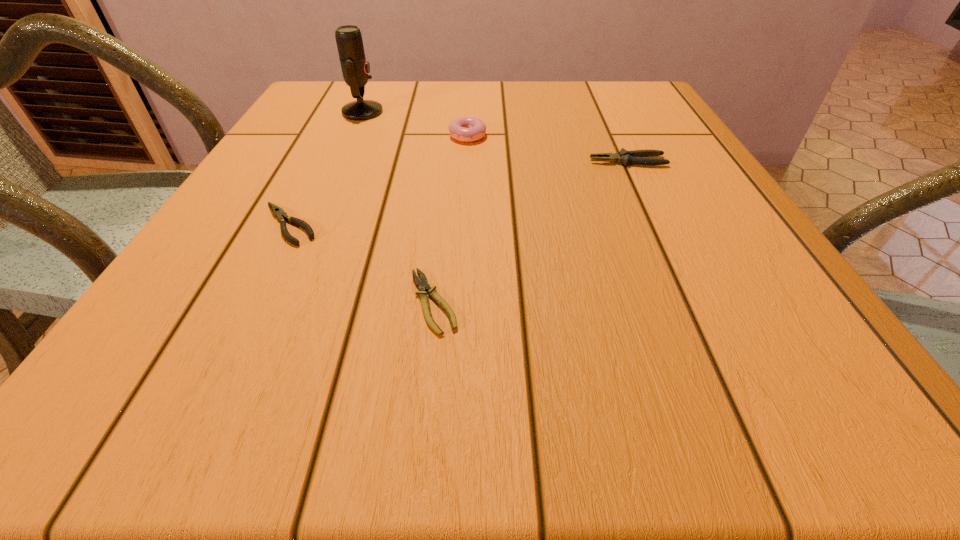
At what (x,y) coordinates should I click in order to perform the action: click on vacant space located on the side of the farthest object with the red ring. Please return your answer as a coordinate pair (x, y). The height and width of the screenshot is (540, 960). Looking at the image, I should click on 412,112.

The height and width of the screenshot is (540, 960). What are the coordinates of `vacant space located 0.310m on the right of the fourth nearest object` in the screenshot? It's located at (x=625, y=134).

Identify the location of vacant space located at the gripping part of the tallest pliers. (540, 161).

Where is `vacant space located 0.160m at the gripping part of the tallest pliers`? The height and width of the screenshot is (540, 960). vacant space located 0.160m at the gripping part of the tallest pliers is located at coordinates (512, 161).

You are a GUI agent. You are given a task and a screenshot of the screen. Output one action in this format:
    pyautogui.click(x=<x>, y=<y>)
    Task: Click on the free region located 0.070m at the gripping part of the tallest pliers
    The height and width of the screenshot is (540, 960).
    Given the screenshot: What is the action you would take?
    pyautogui.click(x=556, y=161)

Where is `free space located on the right of the leftmost pliers`? free space located on the right of the leftmost pliers is located at coordinates (363, 224).

Locate an element on the screen. vacant space located 0.180m on the back of the shortest pliers is located at coordinates (444, 203).

You are a GUI agent. You are given a task and a screenshot of the screen. Output one action in this format:
    pyautogui.click(x=<x>, y=<y>)
    Task: Click on the object located in the far edge section of the desktop
    
    Given the screenshot: What is the action you would take?
    pyautogui.click(x=355, y=68)

Locate an element on the screen. microphone located in the left edge section of the desktop is located at coordinates (355, 68).

Locate an element on the screen. The height and width of the screenshot is (540, 960). pliers that is positioned at the left edge is located at coordinates (278, 212).